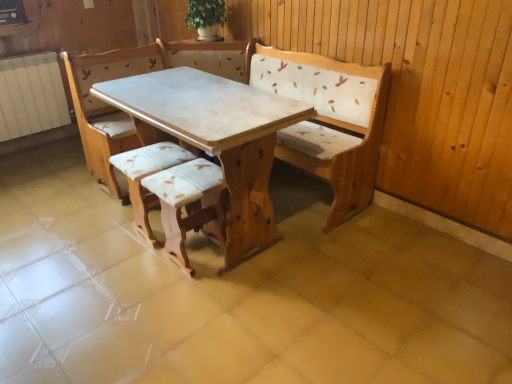
Locate an element on the screen. empty space that is ontop of matte white cushioned stool at center, which is the first armchair in left-to-right order is located at coordinates (150, 154).